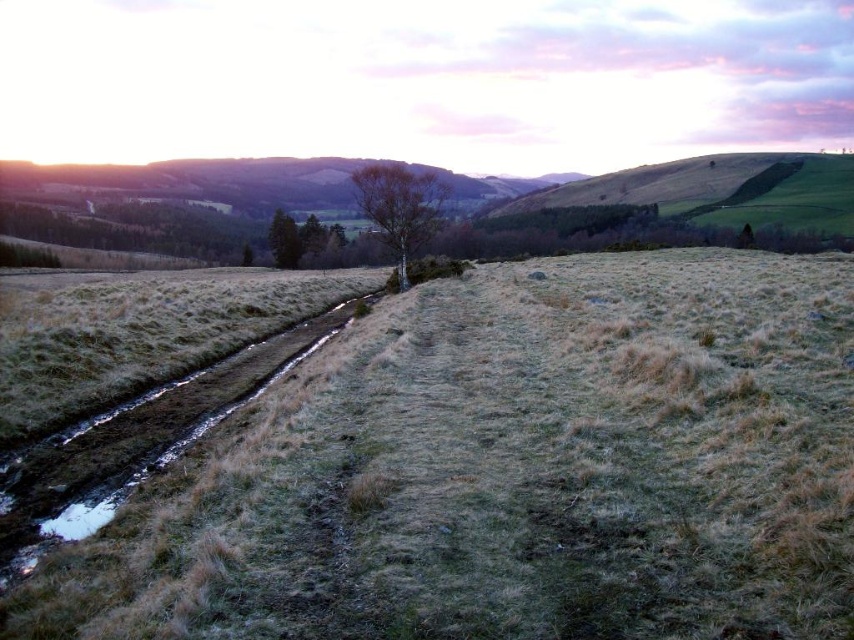
Is green matte tree at center to the left of bare tree at center from the viewer's perspective?

Yes, green matte tree at center is to the left of bare tree at center.

Does point (272, 227) come behind point (313, 243)?

Yes, point (272, 227) is farther from viewer.

Does point (285, 248) come closer to viewer compared to point (300, 241)?

Yes, it is.

The image size is (854, 640). I want to click on green matte tree at center, so click(x=284, y=241).

What do you see at coordinates (721, 189) in the screenshot? The image size is (854, 640). I see `green grassy hillside at upper right` at bounding box center [721, 189].

Is point (811, 221) less distant than point (273, 253)?

That is True.

Find the location of a particular element. green grassy hillside at upper right is located at coordinates (721, 189).

Can you confirm if bare wood tree at center is shorter than bare tree at center?

No.

Based on the photo, is bare wood tree at center to the left of bare tree at center from the viewer's perspective?

Incorrect, bare wood tree at center is not on the left side of bare tree at center.

Between point (433, 177) and point (313, 230), which one is positioned behind?

Positioned behind is point (313, 230).

Locate an element on the screen. The height and width of the screenshot is (640, 854). bare wood tree at center is located at coordinates (401, 209).